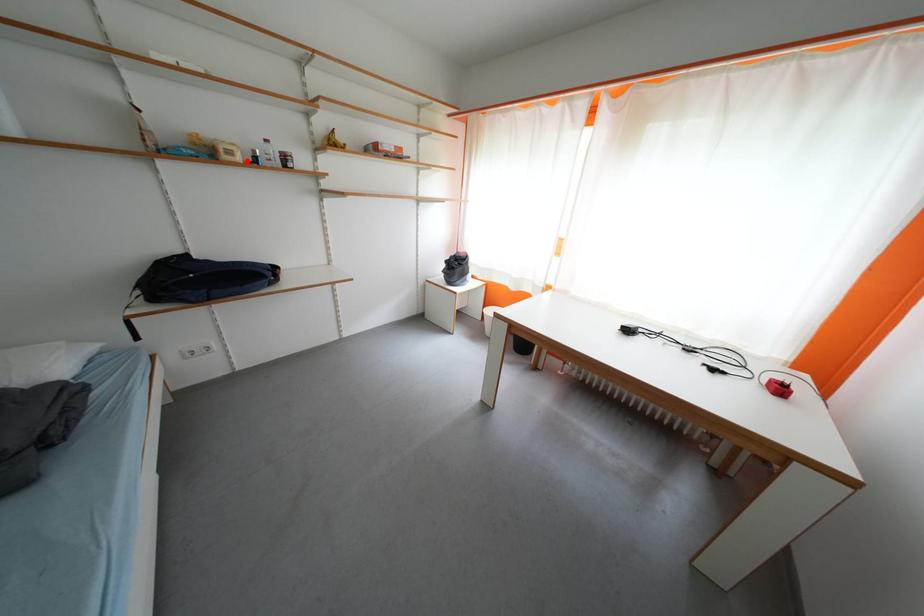
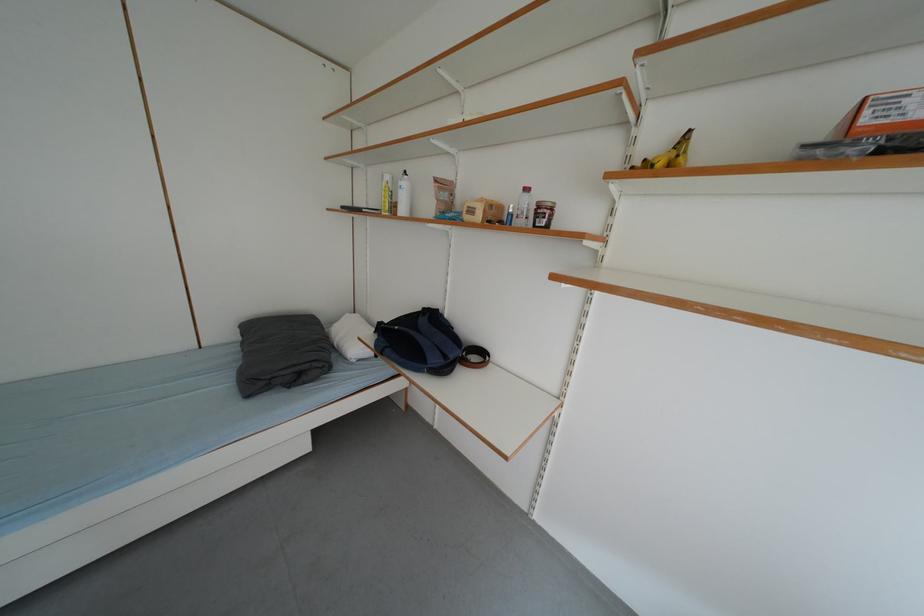
Where in the second image is the point corresponding to the highlighted location from the first image?

(487, 220)